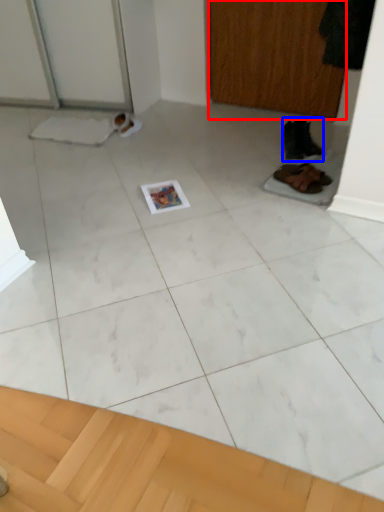
Question: Which of the following is the farthest to the observer, screen door (highlighted by a red box) or footwear (highlighted by a blue box)?

Choices:
 (A) screen door
 (B) footwear

Answer: (A)